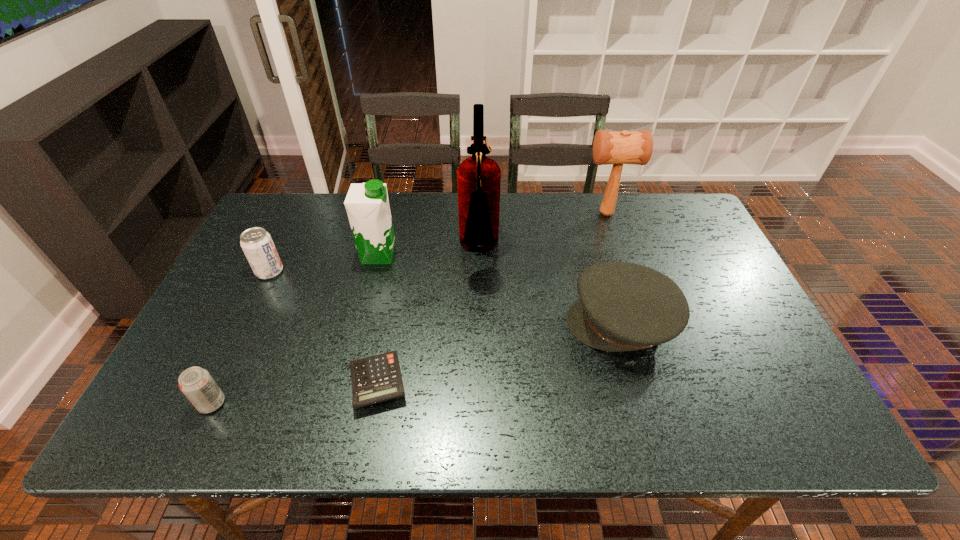
What are the coordinates of `free spot between the tallest object and the second shortest object` in the screenshot? It's located at (346, 327).

Locate an element on the screen. free point between the soya milk and the tallest object is located at coordinates (429, 253).

This screenshot has width=960, height=540. I want to click on vacant area between the soya milk and the beret, so pos(500,288).

This screenshot has width=960, height=540. In order to click on vacant space that's between the beret and the farther soda can in this screenshot , I will do `click(445, 296)`.

Find the location of a particular element. The width and height of the screenshot is (960, 540). unoccupied area between the taller soda can and the beret is located at coordinates (445, 296).

Find the location of a particular element. empty location between the sixth shortest object and the fire extinguisher is located at coordinates (542, 232).

The image size is (960, 540). Find the location of `empty space between the shortest object and the third object from right to left`. empty space between the shortest object and the third object from right to left is located at coordinates (428, 316).

At what (x,y) coordinates should I click in order to perform the action: click on free area in between the tallest object and the beret. Please return your answer as a coordinate pair (x, y). The height and width of the screenshot is (540, 960). Looking at the image, I should click on (550, 286).

You are a GUI agent. You are given a task and a screenshot of the screen. Output one action in this format:
    pyautogui.click(x=<x>, y=<y>)
    Task: Click on the free space between the mallet and the shortest object
    The width and height of the screenshot is (960, 540).
    Given the screenshot: What is the action you would take?
    pyautogui.click(x=492, y=298)

Find the location of `object that is the third nearest to the third tallest object`. object that is the third nearest to the third tallest object is located at coordinates (377, 378).